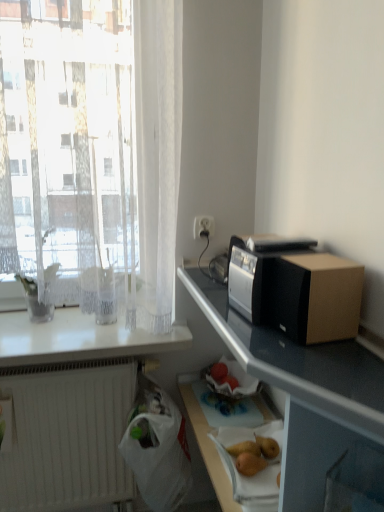
Where is `free spot above black plastic microwave at right (from a real-world perspective)`? This screenshot has width=384, height=512. free spot above black plastic microwave at right (from a real-world perspective) is located at coordinates (273, 247).